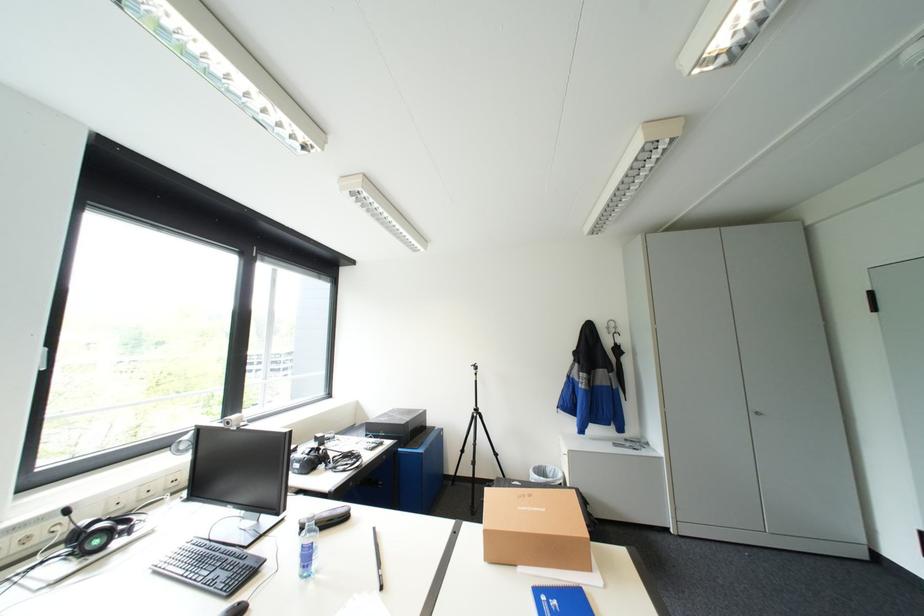
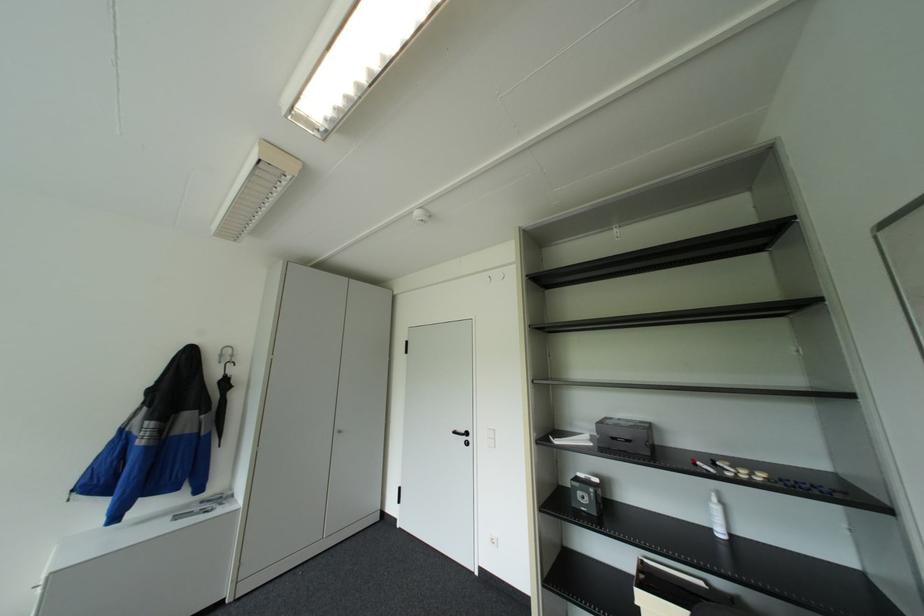
Locate, in the second image, the point that corresponds to point (617, 331) in the first image.

(227, 361)